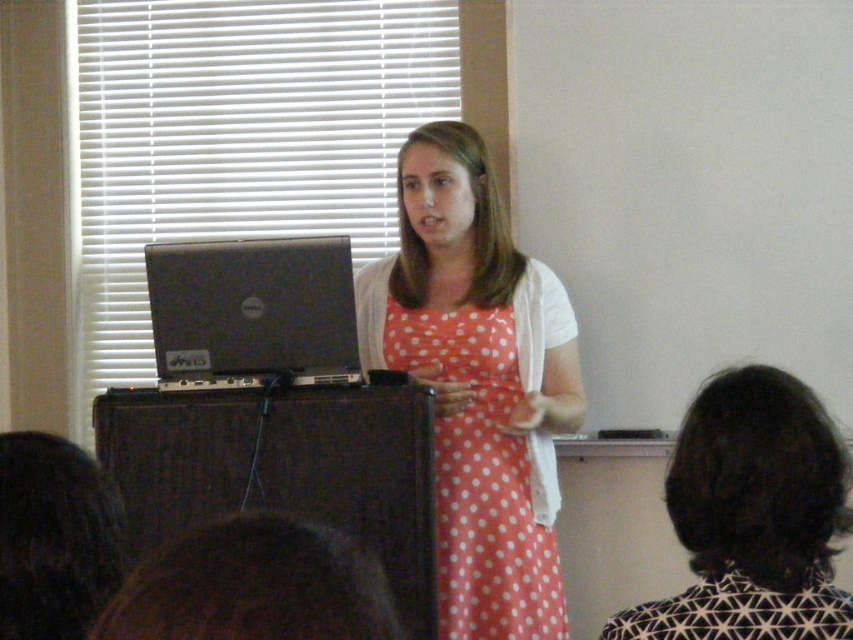
You are a student sitting in the classroom. You notice the polka dot fabric dress at center and the silver metallic laptop at center. Which object is positioned to the left when viewed from your perspective?

The silver metallic laptop at center is positioned to the left of the polka dot fabric dress at center from your perspective.

You are a student sitting in the classroom and you notice two dresses at the center. Which dress is closer to you, the polka dot fabric dress at center or the orange polka dot dress at center?

The polka dot fabric dress at center is closer to you because it is in front of the orange polka dot dress at center.

From the picture: You are a photographer taking a photo of the classroom scene. You notice the polka dot fabric dress at center and the silver metallic laptop at center. Which object should you focus on first if you want to capture both in the same frame without moving the camera?

The polka dot fabric dress at center is positioned under the silver metallic laptop at center, so focusing on the dress first will ensure both objects remain in the frame as the dress is closer to the camera.